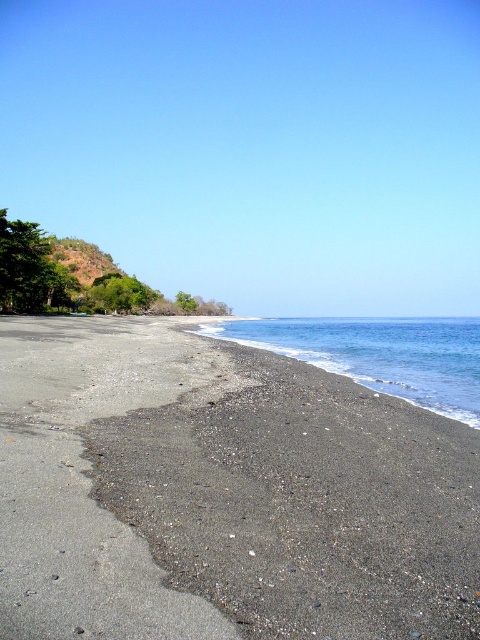
Is point (384, 525) positioned before point (453, 412)?

That is True.

The height and width of the screenshot is (640, 480). What do you see at coordinates (222, 493) in the screenshot?
I see `dark gray sand at lower left` at bounding box center [222, 493].

This screenshot has width=480, height=640. I want to click on dark gray sand at lower left, so click(222, 493).